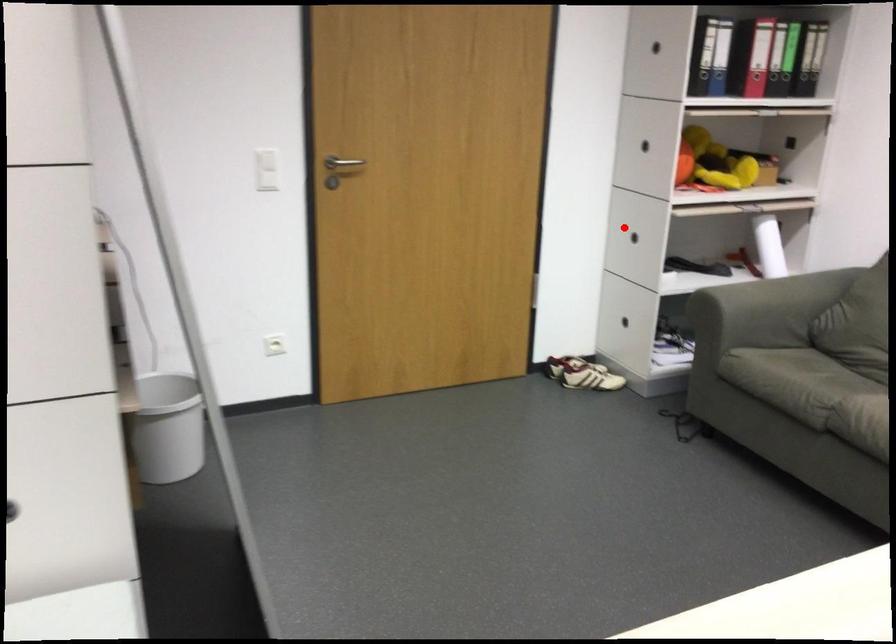
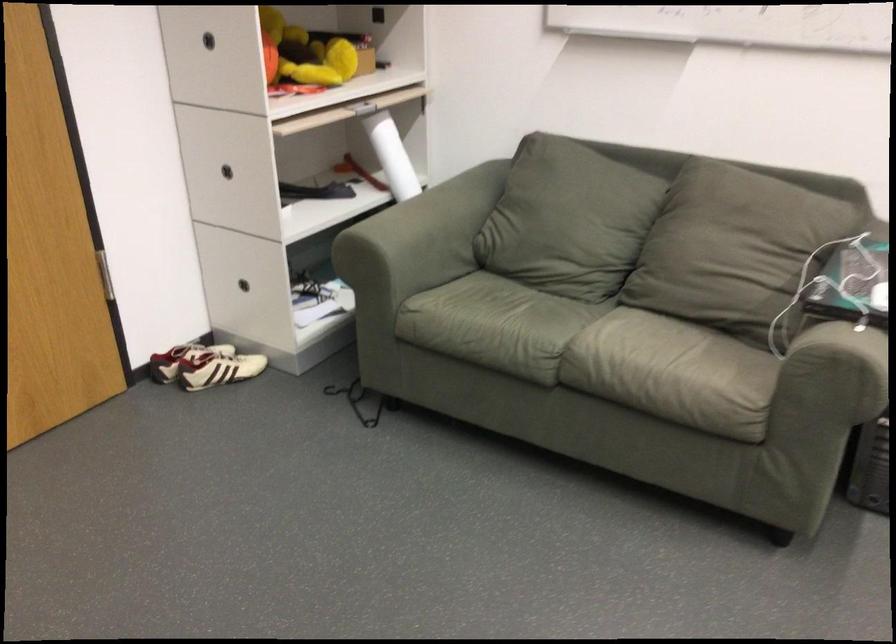
Question: I am providing you with two images of the same scene from different viewpoints. Image1 has a red point marked. In image2, the corresponding 3D location appears at what relative position? Reply with the corresponding letter.

Choices:
 (A) Closer
 (B) Farther

Answer: (A)